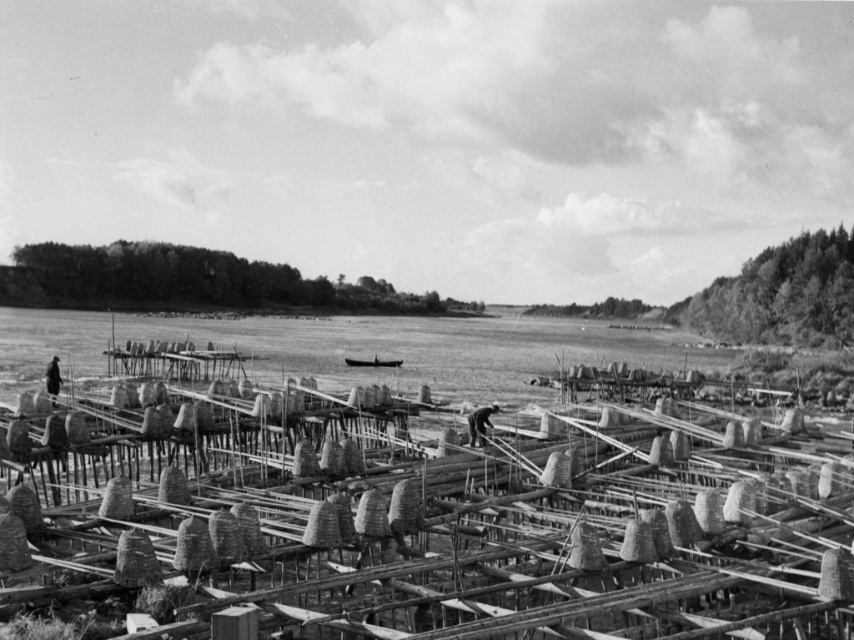
You are a photographer trying to capture a photo of the dark gray fabric worker at center and the dark brown leather jacket at lower left. Which of the two objects is shorter?

The dark gray fabric worker at center is shorter than the dark brown leather jacket at lower left.

You are a safety inspector on the construction site. You notice two workers wearing different clothing. The dark gray fabric worker at center and the dark brown leather jacket at lower left. Which worker is closer to the water surface?

The dark gray fabric worker at center is closer to the water surface because they are positioned below the dark brown leather jacket at lower left.

You are standing at the edge of the construction site near the water. There are two points marked in the image. The first point is at coordinates point (x=483, y=424) and the second point is at point (x=363, y=360). Which point is closer to you?

Point (x=483, y=424) is in front of point (x=363, y=360), so it is closer to you.